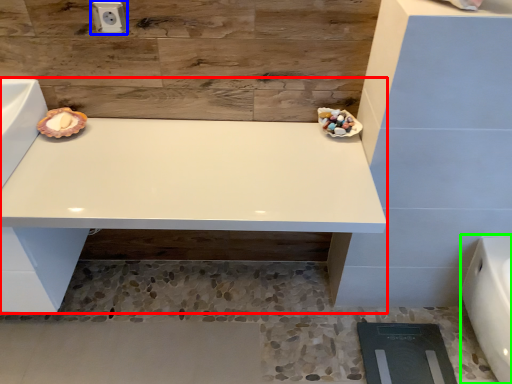
Question: Which object is the farthest from vanity (highlighted by a red box)? Choose among these: electric outlet (highlighted by a blue box) or porcelain (highlighted by a green box).

Choices:
 (A) electric outlet
 (B) porcelain

Answer: (B)